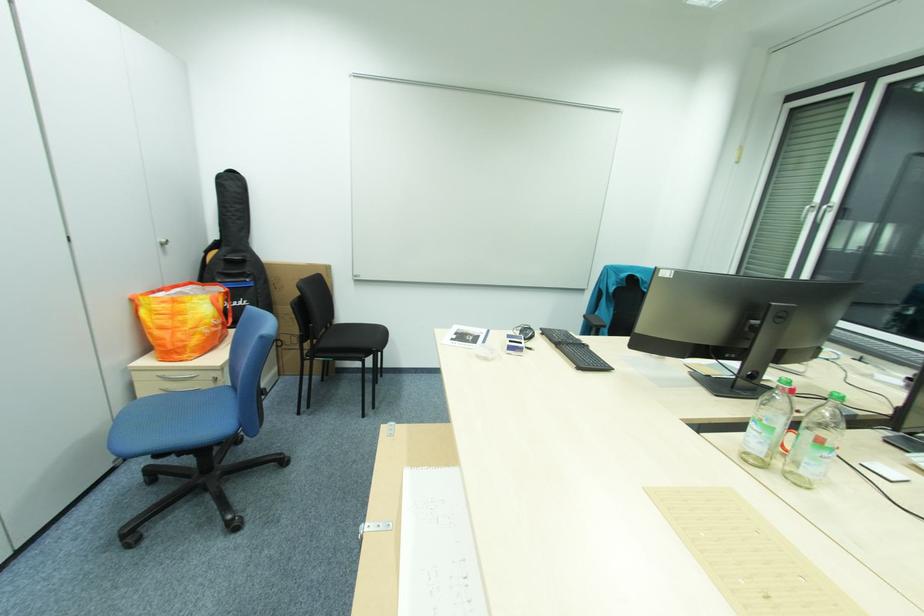
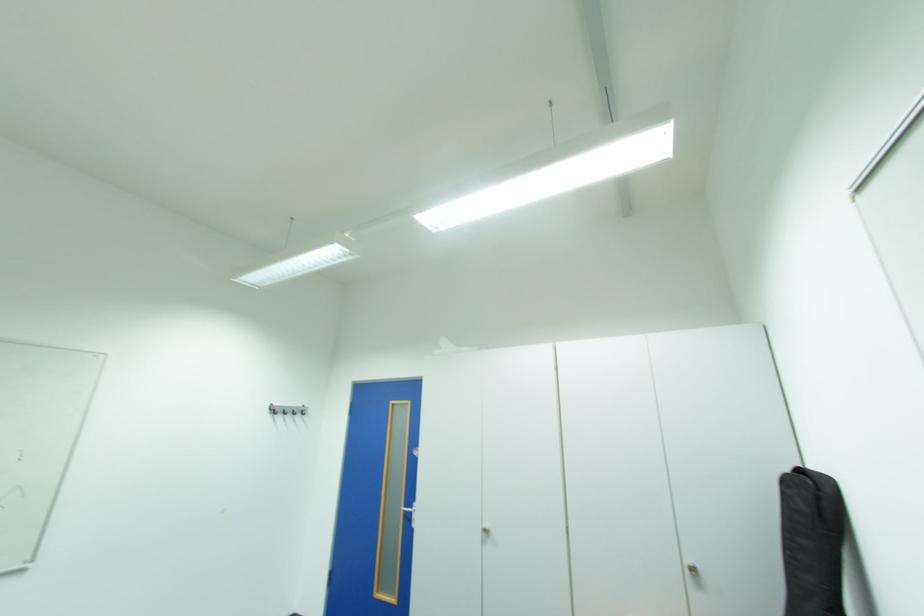
In the second image, find the point that corresponds to (166,245) in the first image.

(697, 570)